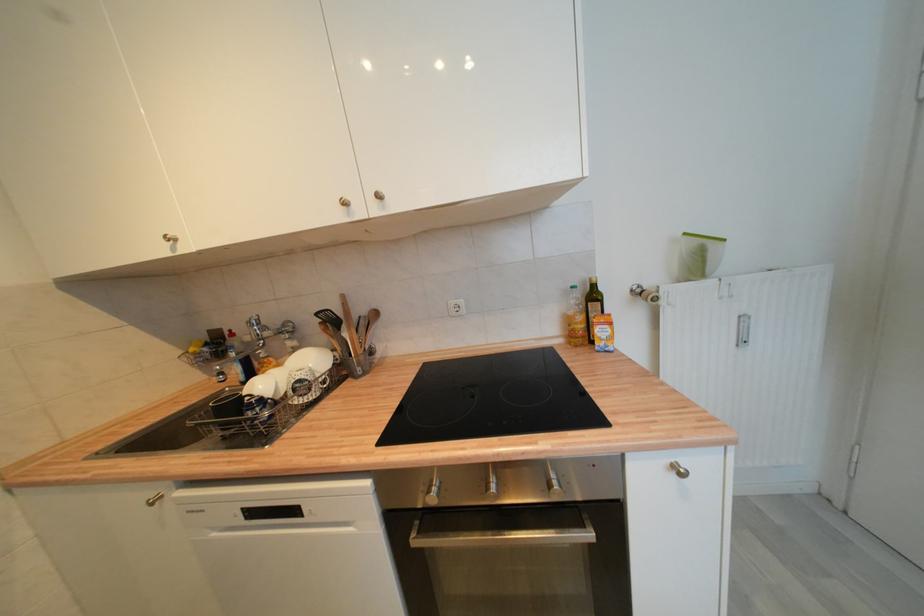
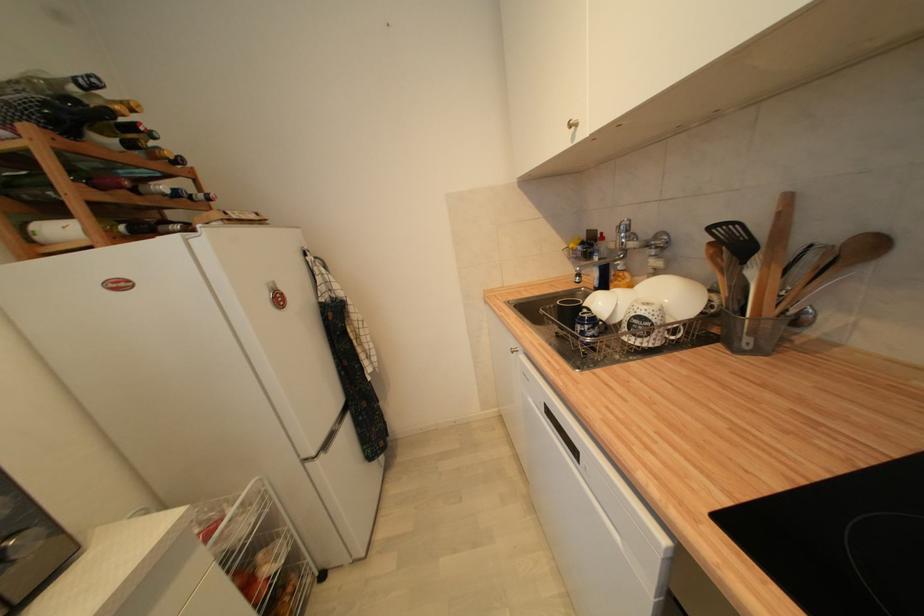
In the second image, find the point that corresponds to point (263, 326) in the first image.

(633, 233)